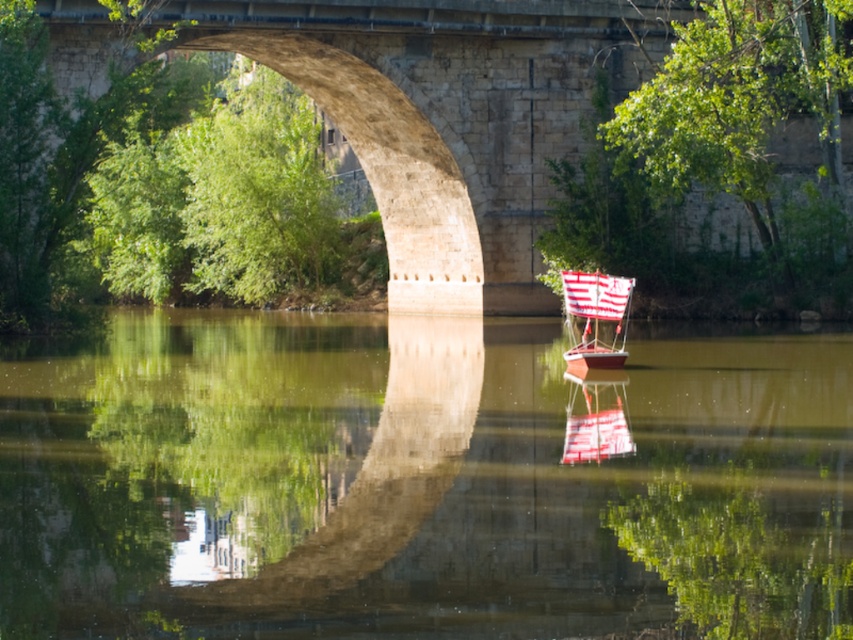
Does green reflective water at center appear over white fabric sailboat at center?

Actually, green reflective water at center is below white fabric sailboat at center.

Between green reflective water at center and white fabric sailboat at center, which one appears on the right side from the viewer's perspective?

white fabric sailboat at center is more to the right.

Is point (194, 464) positioned behind point (567, 355)?

No, it is not.

Where is `green reflective water at center`? The image size is (853, 640). green reflective water at center is located at coordinates (421, 481).

Which is more to the left, stone bridge at center or white fabric sailboat at center?

stone bridge at center is more to the left.

The height and width of the screenshot is (640, 853). What do you see at coordinates (447, 116) in the screenshot?
I see `stone bridge at center` at bounding box center [447, 116].

Who is more forward, (378, 168) or (624, 282)?

Point (624, 282) is in front.

Identify the location of stone bridge at center. The image size is (853, 640). click(447, 116).

Is green reflective water at center smaller than stone bridge at center?

Indeed, green reflective water at center has a smaller size compared to stone bridge at center.

Between green reflective water at center and stone bridge at center, which one appears on the left side from the viewer's perspective?

stone bridge at center is more to the left.

What do you see at coordinates (421, 481) in the screenshot? I see `green reflective water at center` at bounding box center [421, 481].

Identify the location of green reflective water at center. This screenshot has height=640, width=853. (421, 481).